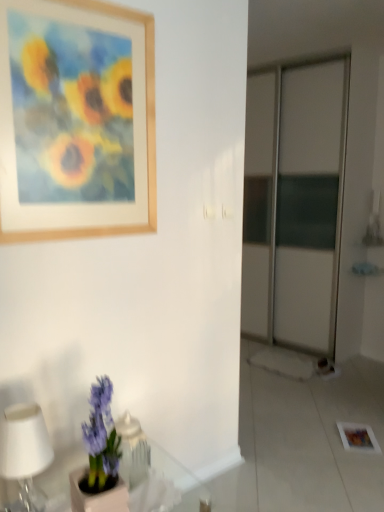
Question: Could purple matte hyacinth at lower left be considered to be inside white matte table lamp at lower left?

Choices:
 (A) no
 (B) yes

Answer: (A)

Question: Is white matte table lamp at lower left not inside purple matte hyacinth at lower left?

Choices:
 (A) no
 (B) yes

Answer: (B)

Question: Can you confirm if white matte table lamp at lower left is smaller than purple matte hyacinth at lower left?

Choices:
 (A) no
 (B) yes

Answer: (B)

Question: Is white matte table lamp at lower left positioned before purple matte hyacinth at lower left?

Choices:
 (A) no
 (B) yes

Answer: (A)

Question: Are white matte table lamp at lower left and purple matte hyacinth at lower left located far from each other?

Choices:
 (A) yes
 (B) no

Answer: (B)

Question: From the image's perspective, does white matte table lamp at lower left appear lower than purple matte hyacinth at lower left?

Choices:
 (A) yes
 (B) no

Answer: (A)

Question: Is white matte table lamp at lower left further to camera compared to wooden picture frame at upper left?

Choices:
 (A) no
 (B) yes

Answer: (A)

Question: Is white matte table lamp at lower left turned away from wooden picture frame at upper left?

Choices:
 (A) yes
 (B) no

Answer: (B)

Question: From a real-world perspective, is white matte table lamp at lower left on wooden picture frame at upper left?

Choices:
 (A) yes
 (B) no

Answer: (B)

Question: Can you confirm if white matte table lamp at lower left is shorter than wooden picture frame at upper left?

Choices:
 (A) no
 (B) yes

Answer: (B)

Question: Does white matte table lamp at lower left have a larger size compared to wooden picture frame at upper left?

Choices:
 (A) yes
 (B) no

Answer: (B)

Question: Could you tell me if white matte table lamp at lower left is turned towards wooden picture frame at upper left?

Choices:
 (A) yes
 (B) no

Answer: (B)

Question: Is translucent glass table at lower left positioned beyond the bounds of purple matte hyacinth at lower left?

Choices:
 (A) yes
 (B) no

Answer: (A)